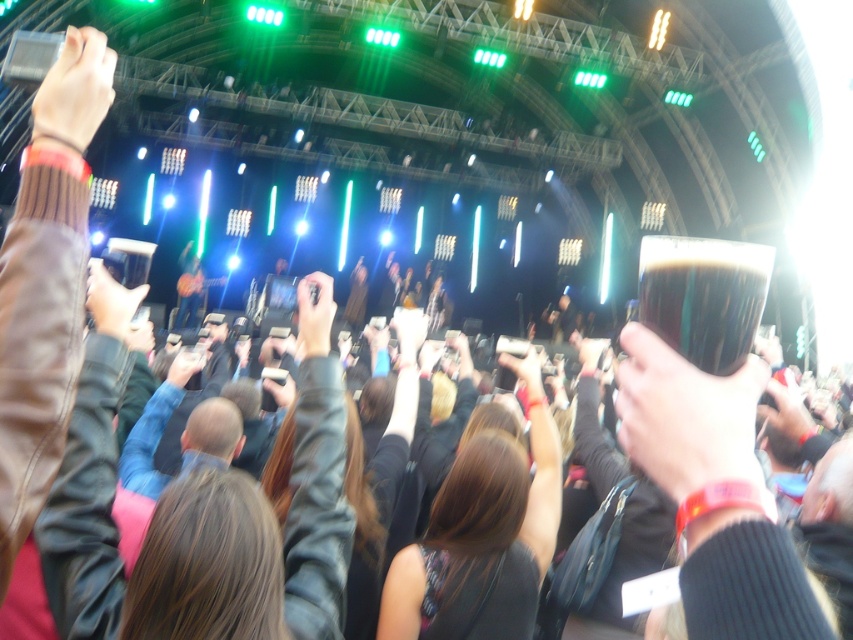
Question: Observing the image, what is the correct spatial positioning of brown leather jacket at center in reference to dark glass beer at upper center?

Choices:
 (A) right
 (B) left

Answer: (B)

Question: Can you confirm if brown leather jacket at center is positioned to the right of dark glass beer at upper center?

Choices:
 (A) yes
 (B) no

Answer: (B)

Question: Can you confirm if brown leather jacket at center is positioned to the right of dark glass beer at upper center?

Choices:
 (A) no
 (B) yes

Answer: (A)

Question: Which point is closer to the camera taking this photo?

Choices:
 (A) (648, 285)
 (B) (554, 465)

Answer: (A)